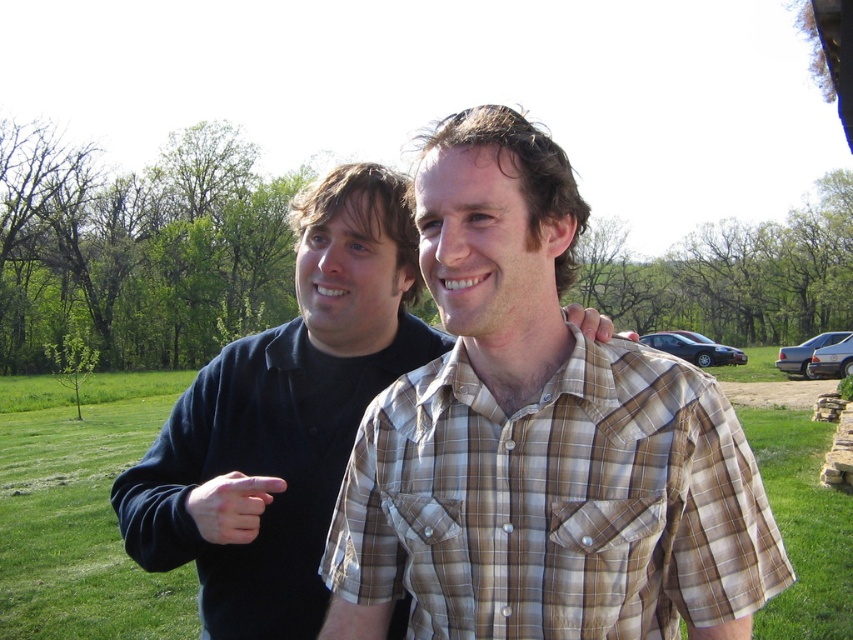
Which is above, black cotton shirt at center or matte skin hand at center?

matte skin hand at center

Between black cotton shirt at center and matte skin hand at center, which one appears on the left side from the viewer's perspective?

Positioned to the left is black cotton shirt at center.

Which is behind, point (154, 563) or point (595, 323)?

Positioned behind is point (154, 563).

The width and height of the screenshot is (853, 640). What are the coordinates of `black cotton shirt at center` in the screenshot? It's located at (287, 412).

Is brown plaid shirt at center positioned behind matte skin hand at center?

No, brown plaid shirt at center is closer to the viewer.

Can you confirm if brown plaid shirt at center is wider than matte skin hand at center?

Incorrect, brown plaid shirt at center's width does not surpass matte skin hand at center's.

Image resolution: width=853 pixels, height=640 pixels. Find the location of `brown plaid shirt at center`. brown plaid shirt at center is located at coordinates (556, 502).

Is point (329, 499) more distant than point (209, 502)?

Yes.

Who is higher up, black cotton shirt at center or matte black finger at center?

Positioned higher is black cotton shirt at center.

Who is more forward, (247, 371) or (236, 474)?

Point (236, 474) is in front.

Locate an element on the screen. The width and height of the screenshot is (853, 640). black cotton shirt at center is located at coordinates (287, 412).